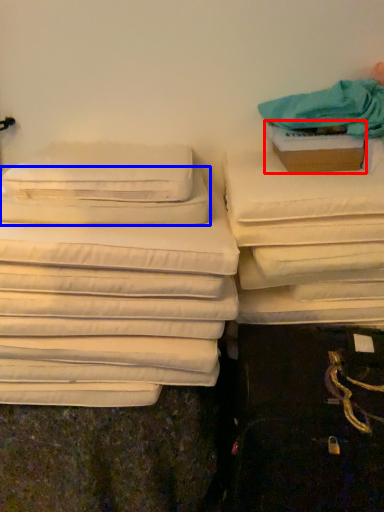
Question: Which object is closer to the camera taking this photo, cardboard box (highlighted by a red box) or pillow (highlighted by a blue box)?

Choices:
 (A) cardboard box
 (B) pillow

Answer: (B)